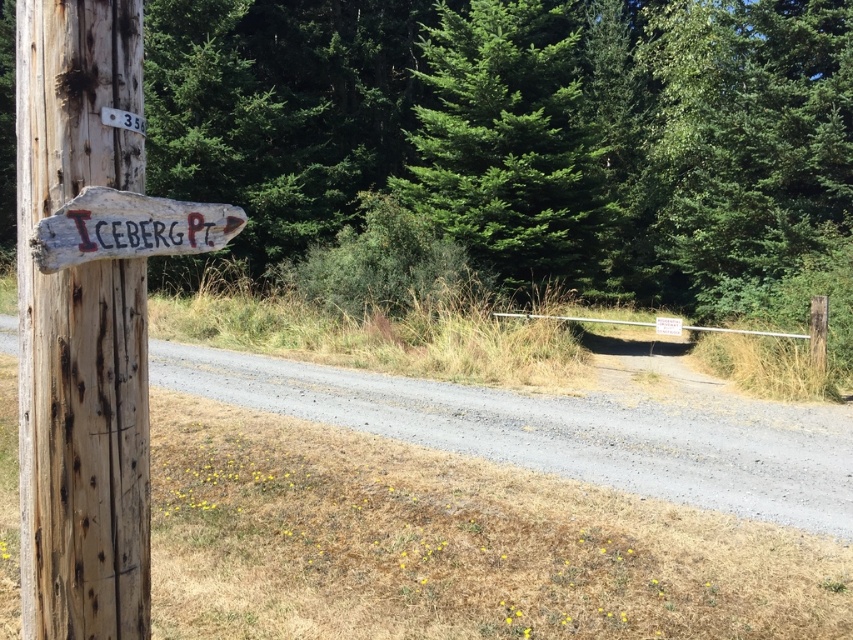
Question: Is weathered wood sign at left wider than green evergreen tree at center?

Choices:
 (A) yes
 (B) no

Answer: (B)

Question: Which point appears farthest from the camera in this image?

Choices:
 (A) (86, 243)
 (B) (583, 220)

Answer: (B)

Question: Observing the image, what is the correct spatial positioning of weathered wood sign at left in reference to weathered wood sign at center-left?

Choices:
 (A) below
 (B) above

Answer: (A)

Question: Is weathered wood sign at left above green evergreen tree at center?

Choices:
 (A) yes
 (B) no

Answer: (B)

Question: Which point is closer to the camera?

Choices:
 (A) green evergreen tree at center
 (B) weathered wood sign at left
 (C) white painted wood at upper left
 (D) weathered wood sign at center-left

Answer: (D)

Question: Estimate the real-world distances between objects in this image. Which object is closer to the white painted wood at upper left?

Choices:
 (A) green evergreen tree at center
 (B) weathered wood sign at center-left
 (C) weathered wood sign at left

Answer: (B)